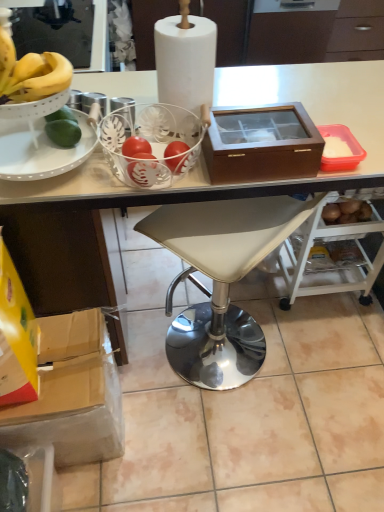
Question: Considering the relative positions of white leather stool at center and cardboard box at lower left in the image provided, is white leather stool at center to the left of cardboard box at lower left from the viewer's perspective?

Choices:
 (A) yes
 (B) no

Answer: (B)

Question: Is white leather stool at center closer to the viewer compared to cardboard box at lower left?

Choices:
 (A) yes
 (B) no

Answer: (A)

Question: From a real-world perspective, does white leather stool at center stand above cardboard box at lower left?

Choices:
 (A) yes
 (B) no

Answer: (A)

Question: Is the position of white leather stool at center more distant than that of cardboard box at lower left?

Choices:
 (A) yes
 (B) no

Answer: (B)

Question: Is white leather stool at center located outside cardboard box at lower left?

Choices:
 (A) no
 (B) yes

Answer: (B)

Question: Is white leather stool at center turned away from cardboard box at lower left?

Choices:
 (A) yes
 (B) no

Answer: (B)

Question: Is white leather stool at center positioned in front of brown wood box at upper right?

Choices:
 (A) no
 (B) yes

Answer: (B)

Question: Is white leather stool at center oriented towards brown wood box at upper right?

Choices:
 (A) yes
 (B) no

Answer: (B)

Question: Is white leather stool at center wider than brown wood box at upper right?

Choices:
 (A) yes
 (B) no

Answer: (A)

Question: Considering the relative sizes of white leather stool at center and brown wood box at upper right in the image provided, is white leather stool at center bigger than brown wood box at upper right?

Choices:
 (A) yes
 (B) no

Answer: (A)

Question: From the image's perspective, is white leather stool at center over brown wood box at upper right?

Choices:
 (A) no
 (B) yes

Answer: (B)

Question: Is brown wood box at upper right completely or partially inside white leather stool at center?

Choices:
 (A) yes
 (B) no

Answer: (B)

Question: Is the depth of white paper at center greater than that of white leather stool at center?

Choices:
 (A) no
 (B) yes

Answer: (A)